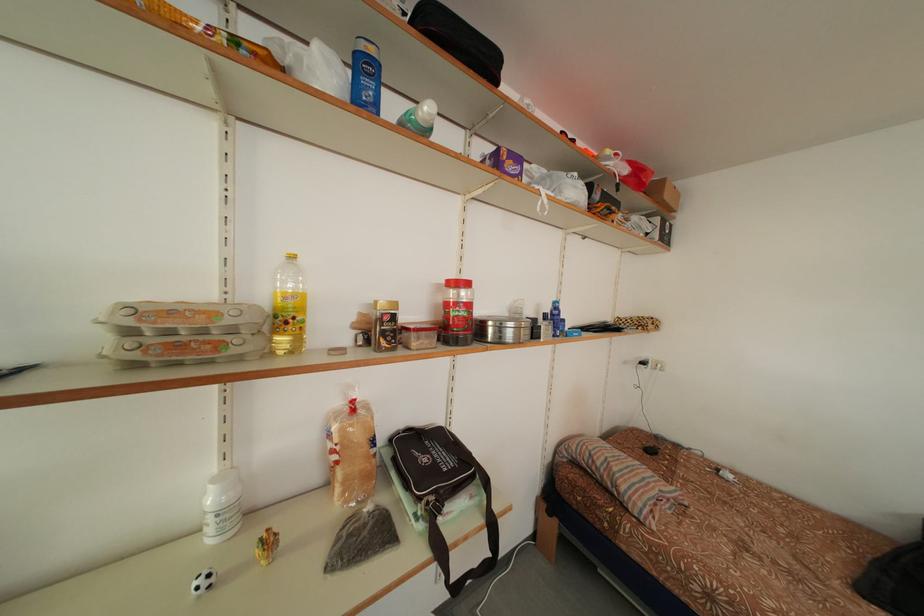
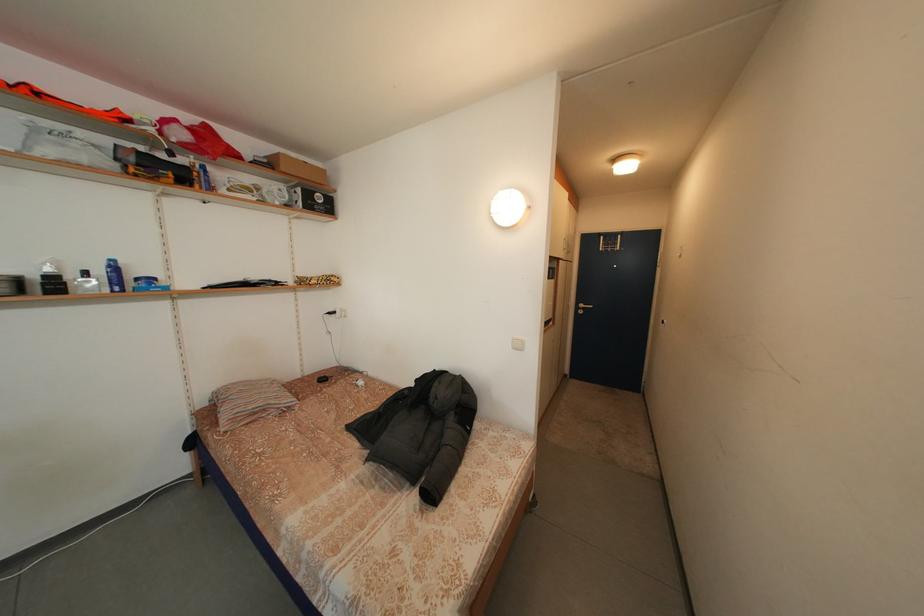
In the second image, find the point that corresponds to (675,201) in the first image.

(292, 175)